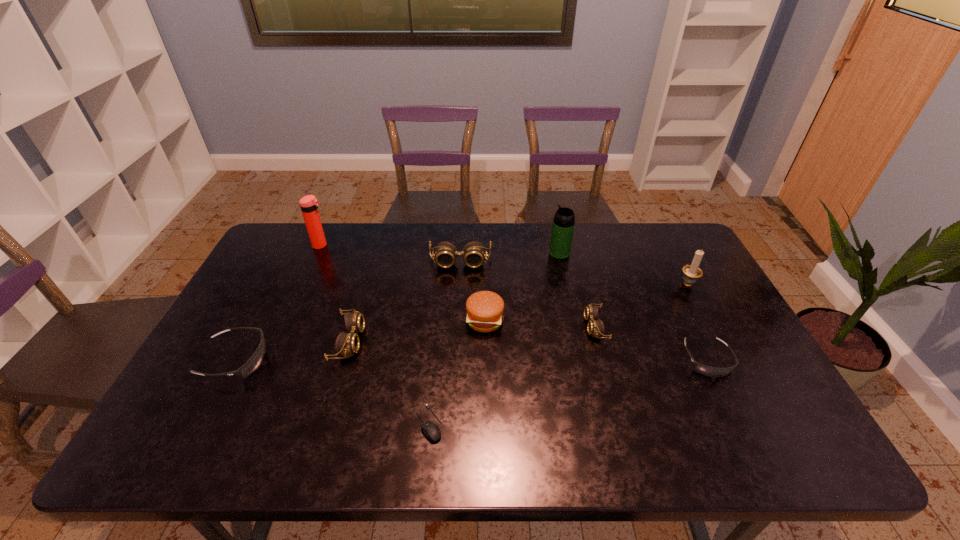
Locate an element on the screen. The height and width of the screenshot is (540, 960). free space located from the spout of the right thermos bottle is located at coordinates (487, 253).

This screenshot has height=540, width=960. I want to click on vacant space located 0.150m on the handle side of the candle_holder, so click(667, 247).

Where is `vacant space located on the handle side of the candle_holder`? The image size is (960, 540). vacant space located on the handle side of the candle_holder is located at coordinates (658, 228).

Image resolution: width=960 pixels, height=540 pixels. Identify the location of vacant area situated 0.340m through the lenses of the farthest brown goggles. (455, 354).

At what (x,y) coordinates should I click in order to perform the action: click on free point located on the right of the hamburger. Please return your answer as a coordinate pair (x, y). Looking at the image, I should click on (605, 320).

The image size is (960, 540). I want to click on free region located 0.230m through the lenses of the eighth object from right to left, so click(x=447, y=341).

Identify the location of vacant area situated 0.250m on the lenses of the bigger black goggles. pos(363,360).

Find the location of `vacant space situated through the lenses of the rightmost brown goggles`. vacant space situated through the lenses of the rightmost brown goggles is located at coordinates (561, 327).

The height and width of the screenshot is (540, 960). Find the location of `vacant space located 0.370m through the lenses of the rightmost brown goggles`. vacant space located 0.370m through the lenses of the rightmost brown goggles is located at coordinates (454, 327).

At what (x,y) coordinates should I click in order to perform the action: click on vacant area situated 0.230m through the lenses of the rightmost brown goggles. Please return your answer as a coordinate pair (x, y). Looking at the image, I should click on (504, 327).